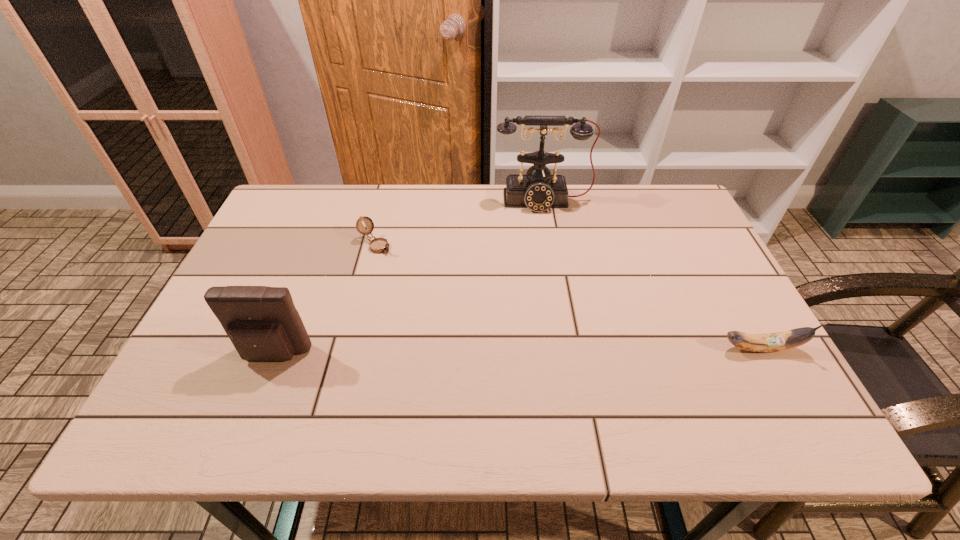
Identify the location of the third shortest object. (262, 322).

Identify the location of pouch. [262, 322].

This screenshot has height=540, width=960. Identify the location of the second shortest object. (785, 340).

At what (x,y) coordinates should I click in order to perform the action: click on the rightmost object. Please return your answer as a coordinate pair (x, y). The image size is (960, 540). Looking at the image, I should click on 785,340.

Find the location of a particular element. This screenshot has width=960, height=540. the tallest object is located at coordinates (538, 190).

Identify the location of telephone. (538, 190).

Where is `compass`? This screenshot has height=540, width=960. compass is located at coordinates (378, 245).

This screenshot has width=960, height=540. What are the coordinates of `the third nearest object` in the screenshot? It's located at (378, 245).

The width and height of the screenshot is (960, 540). What are the coordinates of `free space located on the dial of the tallest object` in the screenshot? It's located at (548, 237).

At what (x,y) coordinates should I click in order to perform the action: click on vacant area located 0.250m on the dial of the tallest object. Please return your answer as a coordinate pair (x, y). Looking at the image, I should click on (553, 271).